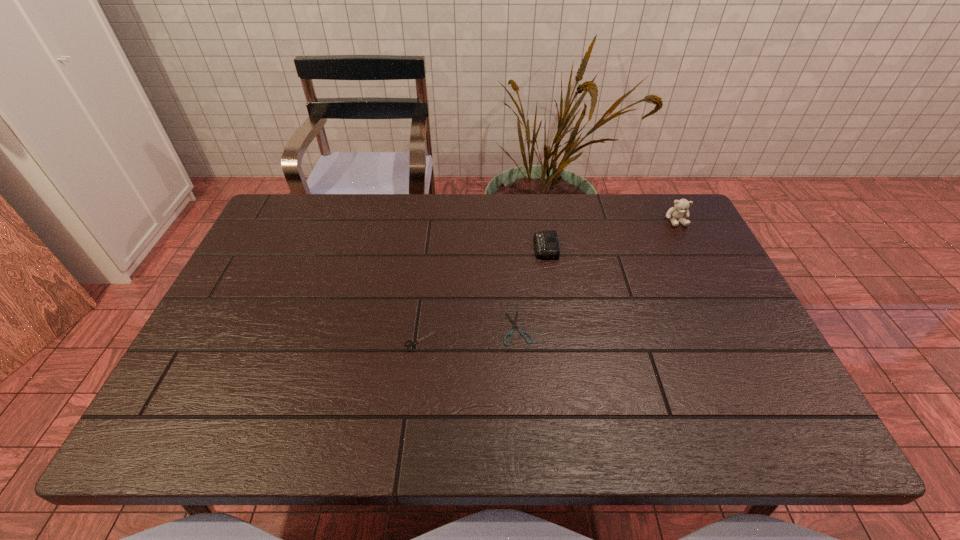
You are a GUI agent. You are given a task and a screenshot of the screen. Output one action in this format:
    pyautogui.click(x=<x>, y=<y>)
    Task: Click on the free space between the second farthest object and the leftmost object
    
    Given the screenshot: What is the action you would take?
    pyautogui.click(x=483, y=294)

This screenshot has width=960, height=540. What are the coordinates of `vacant space that's between the third tallest object and the third nearest object` in the screenshot? It's located at (483, 294).

The width and height of the screenshot is (960, 540). What are the coordinates of `blank region between the shorter shears and the tallest object` in the screenshot? It's located at (597, 274).

The image size is (960, 540). Identify the location of object that stands as the third closest to the right shears. (681, 206).

Choose which object is the third nearest neighbor to the shortest object. Please provide its 2D coordinates. Your answer should be formatted as a tuple, i.e. [(x, y)], where the tuple contains the x and y coordinates of a point satisfying the conditions above.

[(681, 206)]

Where is `vacant position in the image that satisfies the following two spatial constraints: 1. on the face of the teddy bear; 2. on the display of the third shortest object`? vacant position in the image that satisfies the following two spatial constraints: 1. on the face of the teddy bear; 2. on the display of the third shortest object is located at coordinates (690, 247).

What are the coordinates of `vacant space that satisfies the following two spatial constraints: 1. on the display of the alarm clock; 2. on the front side of the right shears` in the screenshot? It's located at (559, 328).

Locate an element on the screen. The width and height of the screenshot is (960, 540). vacant region that satisfies the following two spatial constraints: 1. on the back side of the left shears; 2. on the left side of the shortest object is located at coordinates (421, 328).